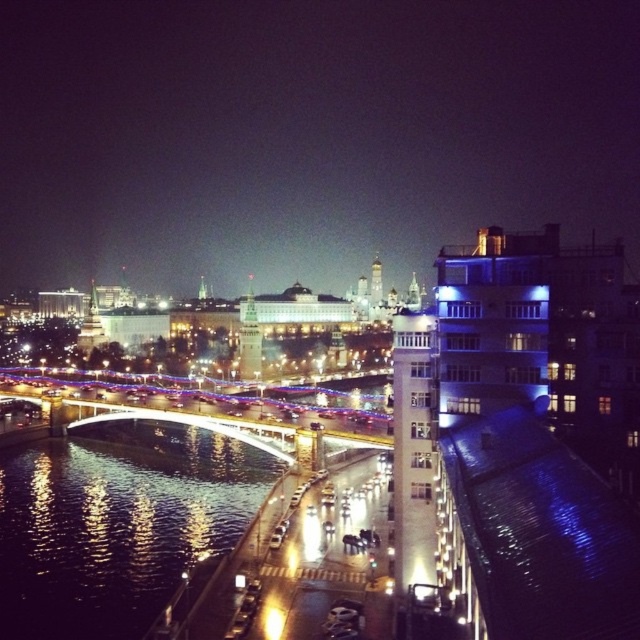
Question: Which point appears farthest from the camera in this image?

Choices:
 (A) (419, 369)
 (B) (371, 292)

Answer: (B)

Question: Estimate the real-world distances between objects in this image. Which object is closer to the gold textured tower at center?

Choices:
 (A) glossy reflective water at lower left
 (B) white marble tower at center
 (C) white glass tower at right

Answer: (A)

Question: Which of these objects is positioned farthest from the white glass tower at right?

Choices:
 (A) glossy reflective water at lower left
 (B) gold textured tower at center

Answer: (B)

Question: Can you confirm if reflective glass bridge at center is wider than white glass tower at right?

Choices:
 (A) no
 (B) yes

Answer: (B)

Question: Can you confirm if reflective glass bridge at center is positioned to the right of gold textured tower at center?

Choices:
 (A) no
 (B) yes

Answer: (B)

Question: Where is glossy reflective water at lower left located in relation to white marble tower at center in the image?

Choices:
 (A) left
 (B) right

Answer: (A)